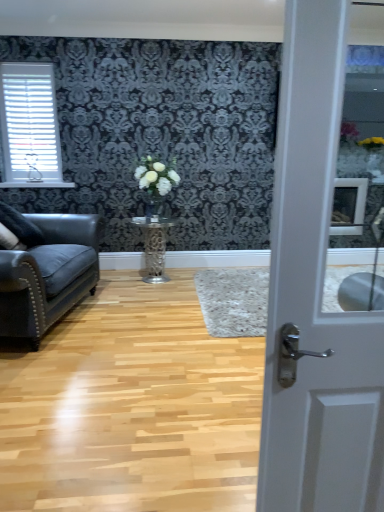
Identify the location of leather couch at left. (49, 274).

This screenshot has width=384, height=512. What are the coordinates of `white plastic blinds at upper left` in the screenshot? It's located at (30, 126).

Where is `black faux fur pillow at left`? This screenshot has width=384, height=512. black faux fur pillow at left is located at coordinates (20, 226).

The image size is (384, 512). What do you see at coordinates (315, 298) in the screenshot?
I see `white glossy door at center` at bounding box center [315, 298].

At what (x,y) coordinates should I click in order to perform the action: click on leather couch at left. Please return your answer as a coordinate pair (x, y). The image size is (384, 512). Looking at the image, I should click on (49, 274).

Can you tell me how much white glossy vase at center and white plastic blinds at upper left differ in facing direction?

The angular difference between white glossy vase at center and white plastic blinds at upper left is 0.0736 degrees.

From the image's perspective, would you say white glossy vase at center is positioned over white plastic blinds at upper left?

Incorrect, from the image's perspective, white glossy vase at center is lower than white plastic blinds at upper left.

Is white glossy vase at center at the left side of white plastic blinds at upper left?

No, white glossy vase at center is not to the left of white plastic blinds at upper left.

From a real-world perspective, which object rests below the other?

In real-world perspective, white glossy vase at center is lower.

Is wooden floor at center at the left side of leather couch at left?

In fact, wooden floor at center is to the right of leather couch at left.

Find the location of a particular element. studio couch that is above the wooden floor at center (from a real-world perspective) is located at coordinates (49, 274).

From the picture: Is wooden floor at center far away from leather couch at left?

No, wooden floor at center is in close proximity to leather couch at left.

Considering the relative sizes of wooden floor at center and leather couch at left in the image provided, is wooden floor at center taller than leather couch at left?

Incorrect, the height of wooden floor at center is not larger of that of leather couch at left.

Can you confirm if white plastic blinds at upper left is bigger than metallic silver table at center?

Incorrect, white plastic blinds at upper left is not larger than metallic silver table at center.

Considering the sizes of objects white plastic blinds at upper left and metallic silver table at center in the image provided, who is shorter, white plastic blinds at upper left or metallic silver table at center?

Standing shorter between the two is metallic silver table at center.

Would you say white plastic blinds at upper left is a long distance from metallic silver table at center?

white plastic blinds at upper left is far away from metallic silver table at center.

Is point (115, 380) behind point (170, 172)?

No, it is not.

Can you confirm if wooden floor at center is wider than white glossy vase at center?

Indeed, wooden floor at center has a greater width compared to white glossy vase at center.

From the image's perspective, between wooden floor at center and white glossy vase at center, who is located below?

wooden floor at center, from the image's perspective.

From the image's perspective, which object appears higher, white glossy door at center or black faux fur pillow at left?

From the image's view, black faux fur pillow at left is above.

From a real-world perspective, between white glossy door at center and black faux fur pillow at left, who is vertically lower?

black faux fur pillow at left is physically lower.

Is black faux fur pillow at left a part of white glossy door at center?

No, black faux fur pillow at left is not surrounded by white glossy door at center.

How much distance is there between white glossy door at center and black faux fur pillow at left?

white glossy door at center is 9.08 feet away from black faux fur pillow at left.

Considering the positions of objects metallic silver table at center and white glossy vase at center in the image provided, who is more to the left, metallic silver table at center or white glossy vase at center?

From the viewer's perspective, metallic silver table at center appears more on the left side.

Is metallic silver table at center situated inside white glossy vase at center or outside?

metallic silver table at center is not inside white glossy vase at center, it's outside.

Is metallic silver table at center further to camera compared to white glossy vase at center?

Yes, metallic silver table at center is further from the viewer.

From a real-world perspective, is metallic silver table at center positioned above or below white glossy vase at center?

metallic silver table at center is below white glossy vase at center.

Is white glossy vase at center directly adjacent to black faux fur pillow at left?

No, white glossy vase at center is not with black faux fur pillow at left.

Which is in front, point (150, 169) or point (42, 242)?

The point (42, 242) is closer to the camera.

Would you say white glossy vase at center contains black faux fur pillow at left?

Definitely not — black faux fur pillow at left is not inside white glossy vase at center.

How many degrees apart are the facing directions of white glossy vase at center and black faux fur pillow at left?

They differ by 77.4 degrees in their facing directions.

I want to click on flower that appears below the white plastic blinds at upper left (from a real-world perspective), so click(156, 176).

Image resolution: width=384 pixels, height=512 pixels. In order to click on studio couch on the left of wooden floor at center in this screenshot , I will do `click(49, 274)`.

Looking at the image, which one is located further to leather couch at left, white glossy door at center or white glossy vase at center?

Based on the image, white glossy door at center appears to be further to leather couch at left.

From the image, which object appears to be nearer to white plastic blinds at upper left, white glossy vase at center or leather couch at left?

white glossy vase at center is closer to white plastic blinds at upper left.

Based on their spatial positions, is white glossy vase at center or metallic silver table at center closer to leather couch at left?

Among the two, metallic silver table at center is located nearer to leather couch at left.

Based on their spatial positions, is leather couch at left or wooden floor at center closer to white glossy door at center?

The object closer to white glossy door at center is wooden floor at center.

Which object lies nearer to the anchor point metallic silver table at center, black faux fur pillow at left or white plastic blinds at upper left?

Based on the image, black faux fur pillow at left appears to be nearer to metallic silver table at center.

Considering their positions, is white glossy door at center positioned further to black faux fur pillow at left than metallic silver table at center?

The object further to black faux fur pillow at left is white glossy door at center.

Estimate the real-world distances between objects in this image. Which object is further from metallic silver table at center, wooden floor at center or black faux fur pillow at left?

Among the two, wooden floor at center is located further to metallic silver table at center.

Estimate the real-world distances between objects in this image. Which object is further from leather couch at left, white plastic blinds at upper left or white glossy vase at center?

Based on the image, white plastic blinds at upper left appears to be further to leather couch at left.

Locate an element on the screen. The image size is (384, 512). plain located between white glossy door at center and black faux fur pillow at left in the depth direction is located at coordinates (131, 407).

At what (x,y) coordinates should I click in order to perform the action: click on pillow that lies between white plastic blinds at upper left and metallic silver table at center from top to bottom. Please return your answer as a coordinate pair (x, y). The width and height of the screenshot is (384, 512). Looking at the image, I should click on (20, 226).

This screenshot has height=512, width=384. What are the coordinates of `table between white glossy door at center and white plastic blinds at upper left from front to back` in the screenshot? It's located at (154, 246).

The width and height of the screenshot is (384, 512). Find the location of `studio couch between white glossy door at center and metallic silver table at center in the front-back direction`. studio couch between white glossy door at center and metallic silver table at center in the front-back direction is located at coordinates (49, 274).